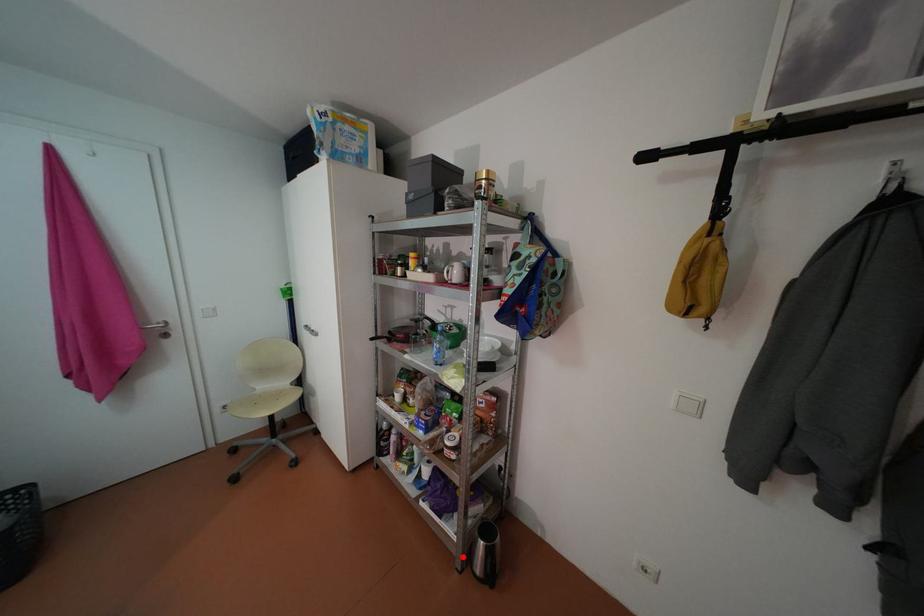
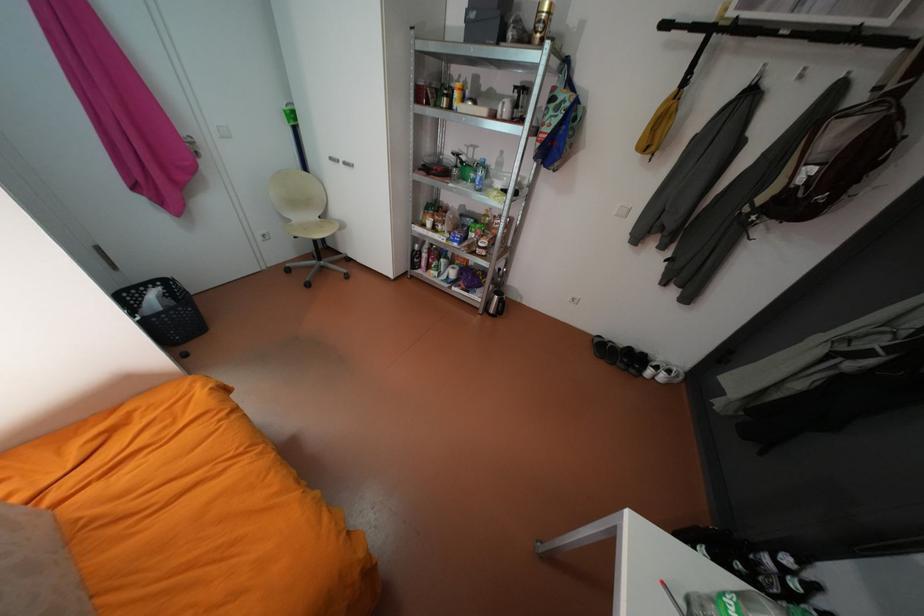
Question: I am providing you with two images of the same scene from different viewpoints. In image1, a red point is highlighted. Considering the same 3D point in image2, which of the following is correct?

Choices:
 (A) It is closer
 (B) It is farther

Answer: (A)